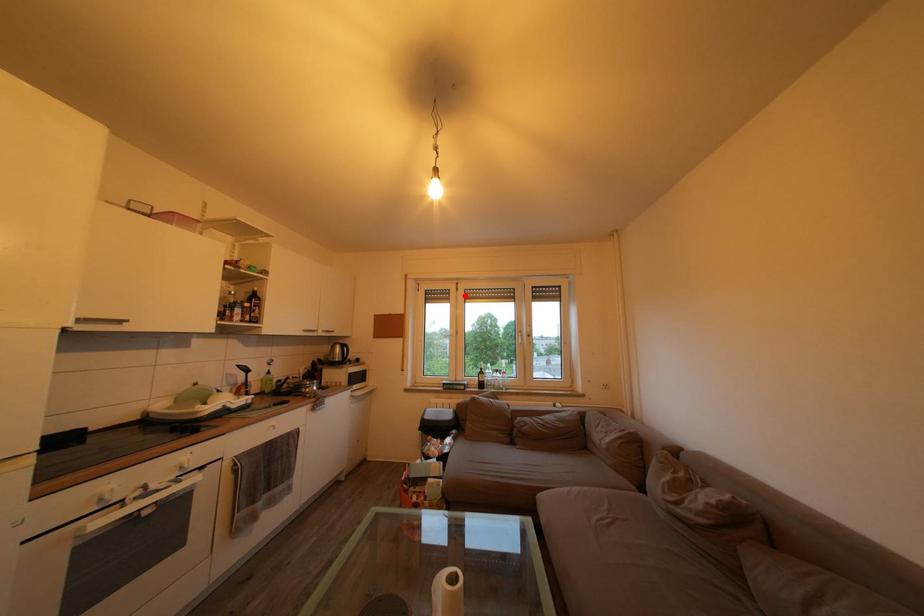
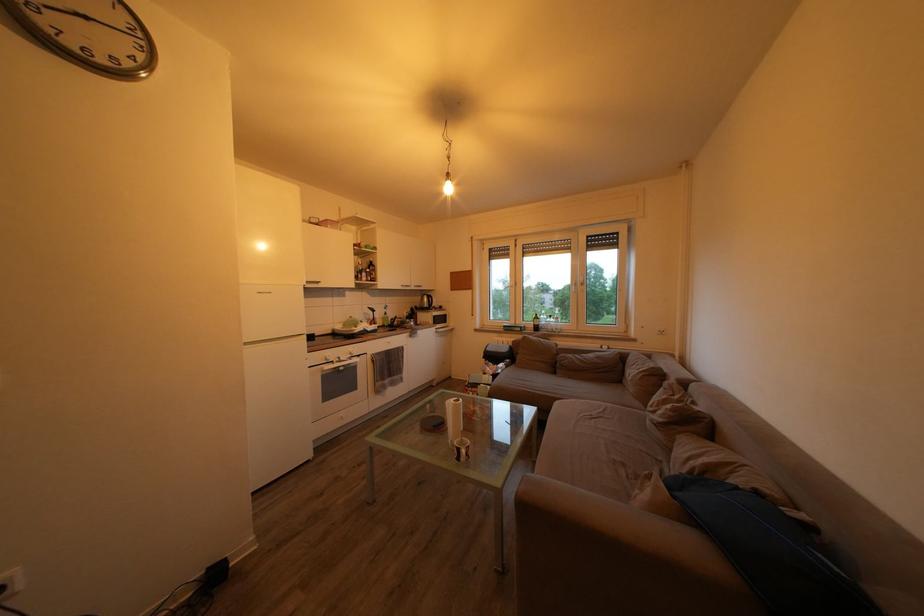
Question: I am providing you with two images of the same scene from different viewpoints. In image1, a red point is highlighted. Considering the same 3D point in image2, which of the following is correct?

Choices:
 (A) It is closer
 (B) It is farther

Answer: (A)